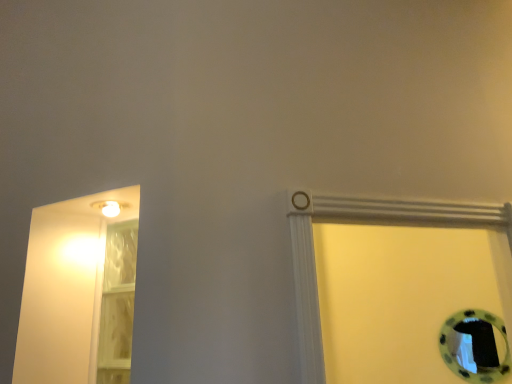
Question: Considering their positions, is transparent plastic door at left located in front of or behind white glossy light fixture at upper left?

Choices:
 (A) front
 (B) behind

Answer: (B)

Question: Looking at the image, does transparent plastic door at left seem bigger or smaller compared to white glossy light fixture at upper left?

Choices:
 (A) big
 (B) small

Answer: (A)

Question: Looking at their shapes, would you say transparent plastic door at left is wider or thinner than white glossy light fixture at upper left?

Choices:
 (A) thin
 (B) wide

Answer: (A)

Question: From the image's perspective, is white glossy light fixture at upper left positioned above or below transparent plastic door at left?

Choices:
 (A) below
 (B) above

Answer: (B)

Question: Is white glossy light fixture at upper left in front of or behind transparent plastic door at left in the image?

Choices:
 (A) behind
 (B) front

Answer: (B)

Question: From a real-world perspective, relative to transparent plastic door at left, is white glossy light fixture at upper left vertically above or below?

Choices:
 (A) above
 (B) below

Answer: (A)

Question: Is white glossy light fixture at upper left wider or thinner than transparent plastic door at left?

Choices:
 (A) wide
 (B) thin

Answer: (A)